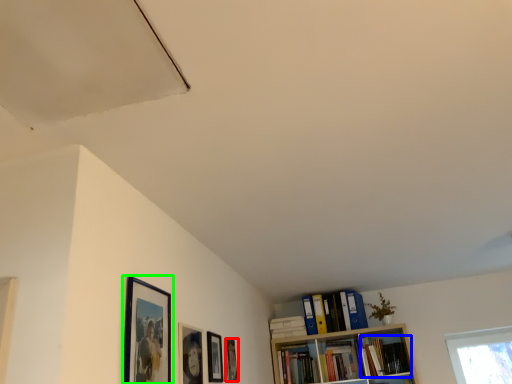
Question: Which object is the closest to the picture frame (highlighted by a red box)? Choose among these: book (highlighted by a blue box) or picture frame (highlighted by a green box).

Choices:
 (A) book
 (B) picture frame

Answer: (B)